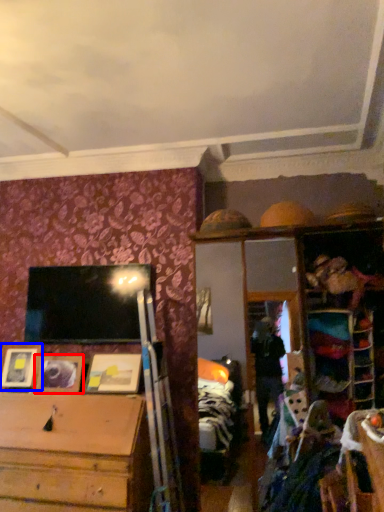
Question: Which of the following is the farthest to the observer, picture frame (highlighted by a red box) or picture frame (highlighted by a blue box)?

Choices:
 (A) picture frame
 (B) picture frame

Answer: (B)